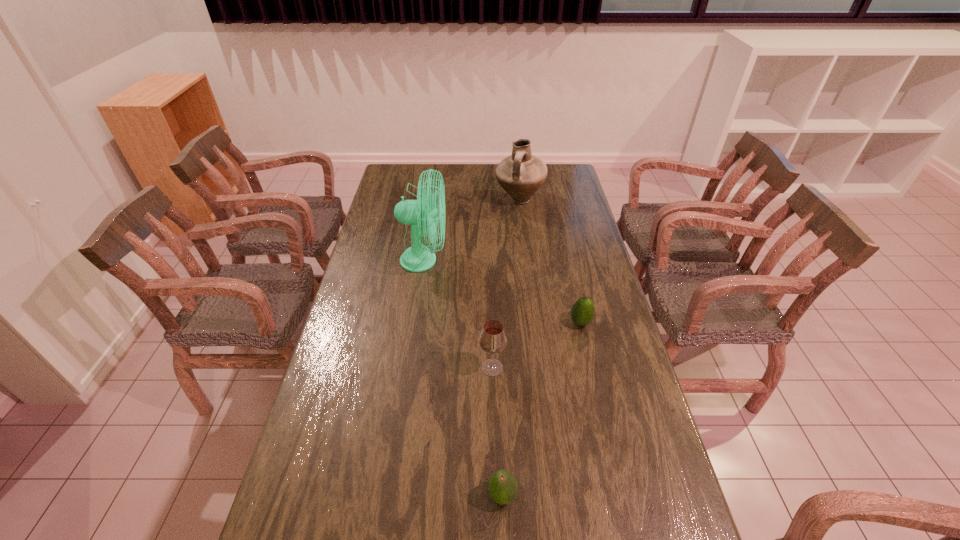
Where is `vacant space at the right edge of the desktop`? vacant space at the right edge of the desktop is located at coordinates (577, 332).

Locate an element on the screen. vacant region at the far left corner is located at coordinates click(410, 165).

You are a GUI agent. You are given a task and a screenshot of the screen. Output one action in this format:
    pyautogui.click(x=<x>, y=<y>)
    Task: Click on the vacant space that's between the farthest object and the leftmost object
    The image size is (960, 540).
    Given the screenshot: What is the action you would take?
    pyautogui.click(x=471, y=230)

Identify the location of free space between the fan and the wineglass. This screenshot has width=960, height=540. (458, 314).

The image size is (960, 540). In order to click on vacant area between the left avocado and the right avocado in this screenshot , I will do `click(541, 409)`.

The image size is (960, 540). What are the coordinates of `vacant area between the left avocado and the second nearest object` in the screenshot? It's located at (497, 431).

Locate an element on the screen. Image resolution: width=960 pixels, height=540 pixels. vacant space that's between the left avocado and the tallest object is located at coordinates click(463, 377).

Locate an element on the screen. The height and width of the screenshot is (540, 960). free space between the nearer avocado and the farther avocado is located at coordinates (541, 409).

Select which object is the fourth closest to the rightmost object. Please provide its 2D coordinates. Your answer should be formatted as a tuple, i.e. [(x, y)], where the tuple contains the x and y coordinates of a point satisfying the conditions above.

[(521, 174)]

Locate an element on the screen. object that is the nearest to the rightmost object is located at coordinates (493, 339).